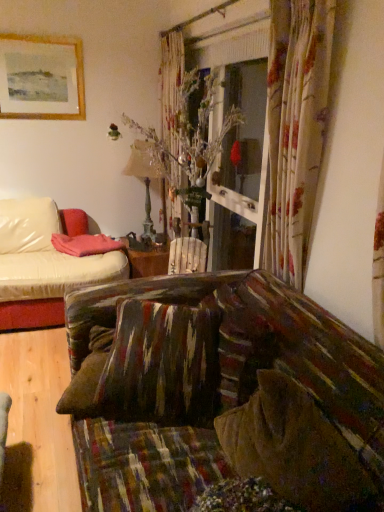
Question: Is textured brown pillow at center facing away from gold-framed painting at upper left?

Choices:
 (A) yes
 (B) no

Answer: (B)

Question: Does textured brown pillow at center have a lesser width compared to gold-framed painting at upper left?

Choices:
 (A) yes
 (B) no

Answer: (B)

Question: Is textured brown pillow at center positioned in front of gold-framed painting at upper left?

Choices:
 (A) no
 (B) yes

Answer: (B)

Question: Is textured brown pillow at center wider than gold-framed painting at upper left?

Choices:
 (A) yes
 (B) no

Answer: (A)

Question: Is textured brown pillow at center to the right of gold-framed painting at upper left from the viewer's perspective?

Choices:
 (A) yes
 (B) no

Answer: (A)

Question: From a real-world perspective, is textured brown pillow at center located higher than gold-framed painting at upper left?

Choices:
 (A) yes
 (B) no

Answer: (B)

Question: Considering the relative sizes of gold-framed painting at upper left and textured brown pillow at center in the image provided, is gold-framed painting at upper left thinner than textured brown pillow at center?

Choices:
 (A) yes
 (B) no

Answer: (A)

Question: From a real-world perspective, is gold-framed painting at upper left physically below textured brown pillow at center?

Choices:
 (A) no
 (B) yes

Answer: (A)

Question: Does gold-framed painting at upper left come in front of textured brown pillow at center?

Choices:
 (A) yes
 (B) no

Answer: (B)

Question: From the image's perspective, is gold-framed painting at upper left under textured brown pillow at center?

Choices:
 (A) yes
 (B) no

Answer: (B)

Question: From the image's perspective, is gold-framed painting at upper left above textured brown pillow at center?

Choices:
 (A) no
 (B) yes

Answer: (B)

Question: Is gold-framed painting at upper left wider than textured brown pillow at center?

Choices:
 (A) yes
 (B) no

Answer: (B)

Question: Is textured brown pillow at center to the left or to the right of gold-framed painting at upper left in the image?

Choices:
 (A) left
 (B) right

Answer: (B)